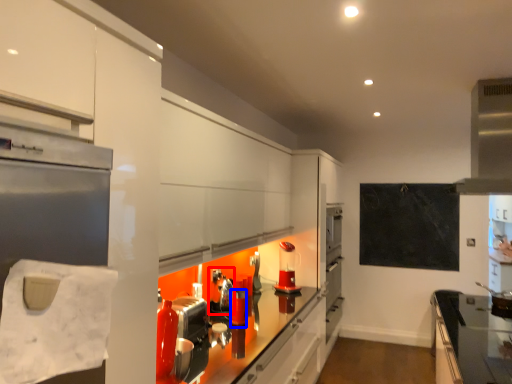
Question: Among these objects, which one is nearest to the camera, appliance (highlighted by a red box) or appliance (highlighted by a blue box)?

Choices:
 (A) appliance
 (B) appliance

Answer: (B)